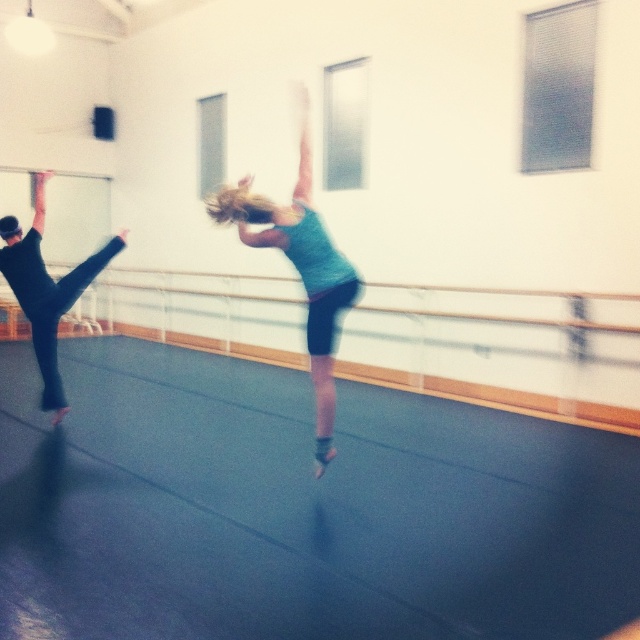
Which is behind, point (332, 296) or point (10, 272)?

Point (10, 272)

This screenshot has width=640, height=640. What do you see at coordinates (300, 269) in the screenshot?
I see `teal fabric ballerina at center` at bounding box center [300, 269].

Where is `teal fabric ballerina at center`? Image resolution: width=640 pixels, height=640 pixels. teal fabric ballerina at center is located at coordinates (300, 269).